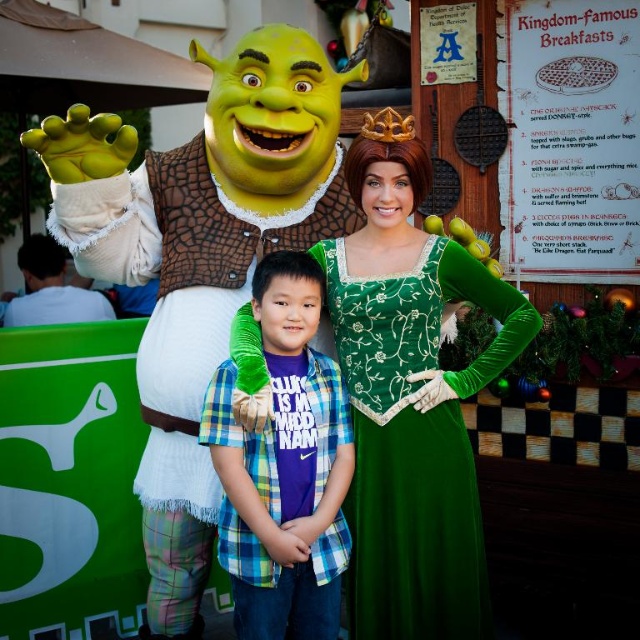
Question: Does matte green costume at left come behind velvet green dress at center?

Choices:
 (A) yes
 (B) no

Answer: (B)

Question: Considering the real-world distances, which object is closest to the velvet green dress at center?

Choices:
 (A) matte green costume at left
 (B) plaid shirt at center

Answer: (B)

Question: Which point appears farthest from the camera in this image?

Choices:
 (A) (291, 378)
 (B) (205, 211)
 (C) (518, 292)

Answer: (B)

Question: Which point is closer to the camera?

Choices:
 (A) (467, 598)
 (B) (241, 545)
 (C) (156, 216)

Answer: (B)

Question: Does velvet green dress at center lie in front of plaid shirt at center?

Choices:
 (A) yes
 (B) no

Answer: (B)

Question: Considering the relative positions of matte green costume at left and velvet green dress at center in the image provided, where is matte green costume at left located with respect to velvet green dress at center?

Choices:
 (A) left
 (B) right

Answer: (A)